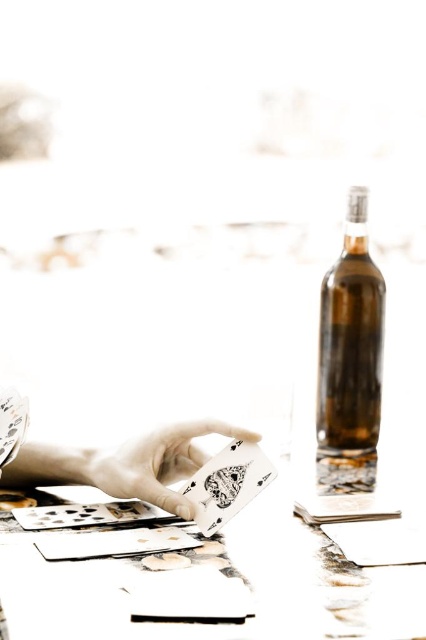
Consider the image. You are a bartender preparing a drink and need to reach for the brown glass bottle at right and the white matte playing card at center. Which object is located to the right side of the other?

The brown glass bottle at right is to the right of the white matte playing card at center.

From the picture: You are a bartender preparing to place a new bottle on the table. The table has a coordinate system where the bottom left corner is the origin. You need to place the bottle exactly at point (x=351, y=344). However, there is already an object at that location. What object is currently occupying that spot?

The brown glass bottle at right is located at point (x=351, y=344).

You are a bartender preparing to place a brown glass bottle at right and a white matte playing card at center on a shelf. The shelf has a width of 10 cm. Can both items fit side by side on the shelf without overlapping?

The brown glass bottle at right is narrower than the white matte playing card at center. However, since the total width of both items combined is not specified, we cannot determine if they can fit on the 10 cm shelf without overlapping. More information is needed about their individual widths.